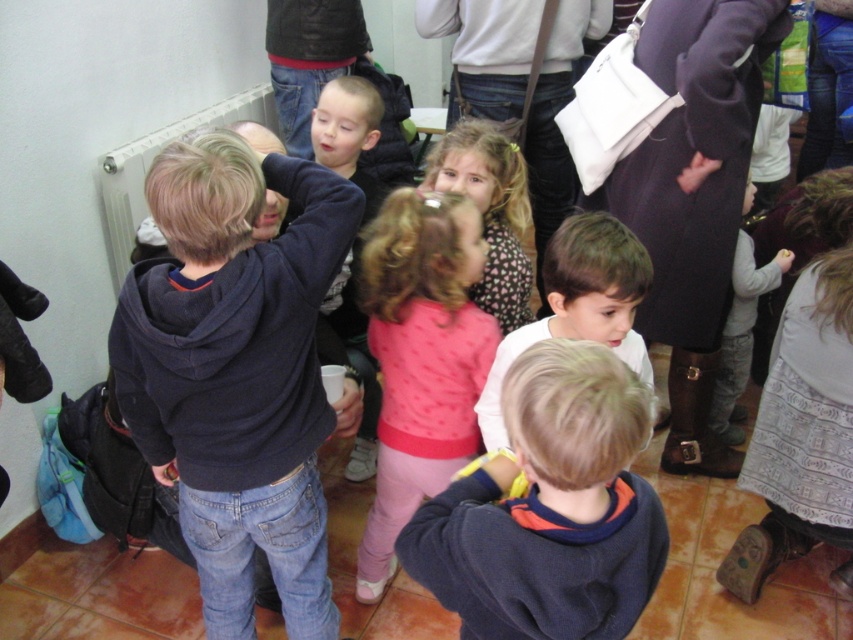
Which is in front, point (596, 403) or point (409, 230)?

Point (596, 403) is in front.

Can you confirm if dark blue sweatshirt at center is positioned below pink fabric dress at center?

Correct, dark blue sweatshirt at center is located below pink fabric dress at center.

Who is more distant from viewer, [497,481] or [473,237]?

The point [473,237] is behind.

Where is `dark blue sweatshirt at center`? This screenshot has height=640, width=853. dark blue sweatshirt at center is located at coordinates (549, 508).

Can you confirm if dark blue hoodie at center is positioned above dark blue sweatshirt at center?

Indeed, dark blue hoodie at center is positioned over dark blue sweatshirt at center.

Who is higher up, dark blue hoodie at center or dark blue sweatshirt at center?

Positioned higher is dark blue hoodie at center.

Does point (167, 300) come behind point (544, 605)?

Yes, it is behind point (544, 605).

Locate an element on the screen. Image resolution: width=853 pixels, height=640 pixels. dark blue hoodie at center is located at coordinates (236, 371).

Describe the element at coordinates (236, 371) in the screenshot. I see `dark blue hoodie at center` at that location.

Can you confirm if dark blue hoodie at center is positioned to the right of pink fabric dress at center?

No, dark blue hoodie at center is not to the right of pink fabric dress at center.

Is point (312, 300) positioned before point (402, 257)?

Yes, point (312, 300) is closer to viewer.

At what (x,y) coordinates should I click in order to perform the action: click on dark blue hoodie at center. Please return your answer as a coordinate pair (x, y). Looking at the image, I should click on (236, 371).